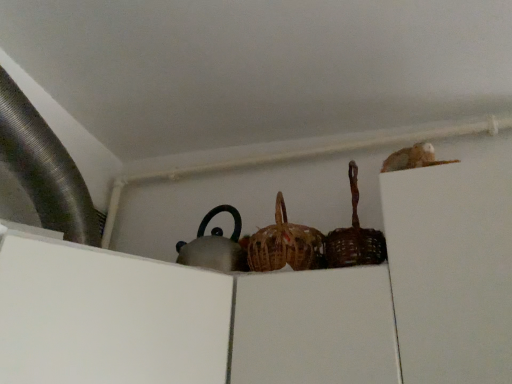
Question: From a real-world perspective, relative to woven brown basket at center, which is counted as the 1th basket, starting from the left, is brown woven basket at center, the 2th basket positioned from the left, vertically above or below?

Choices:
 (A) above
 (B) below

Answer: (B)

Question: In terms of height, does brown woven basket at center, which appears as the 1th basket when viewed from the right, look taller or shorter compared to woven brown basket at center, which is counted as the 1th basket, starting from the left?

Choices:
 (A) tall
 (B) short

Answer: (B)

Question: Looking at the image, does brown woven basket at center, the 2th basket positioned from the left, seem bigger or smaller compared to woven brown basket at center, which is counted as the 1th basket, starting from the left?

Choices:
 (A) small
 (B) big

Answer: (A)

Question: Considering the positions of woven brown basket at center, which is counted as the second basket, starting from the right, and brown woven basket at center, which appears as the 1th basket when viewed from the right, in the image, is woven brown basket at center, which is counted as the second basket, starting from the right, wider or thinner than brown woven basket at center, which appears as the 1th basket when viewed from the right,?

Choices:
 (A) wide
 (B) thin

Answer: (A)

Question: From a real-world perspective, relative to brown woven basket at center, which appears as the 1th basket when viewed from the right, is woven brown basket at center, which is counted as the second basket, starting from the right, vertically above or below?

Choices:
 (A) above
 (B) below

Answer: (A)

Question: Does point (308, 231) appear closer or farther from the camera than point (365, 258)?

Choices:
 (A) closer
 (B) farther

Answer: (B)

Question: Looking at the image, does woven brown basket at center, which is counted as the 1th basket, starting from the left, seem bigger or smaller compared to brown woven basket at center, the 2th basket positioned from the left?

Choices:
 (A) big
 (B) small

Answer: (A)